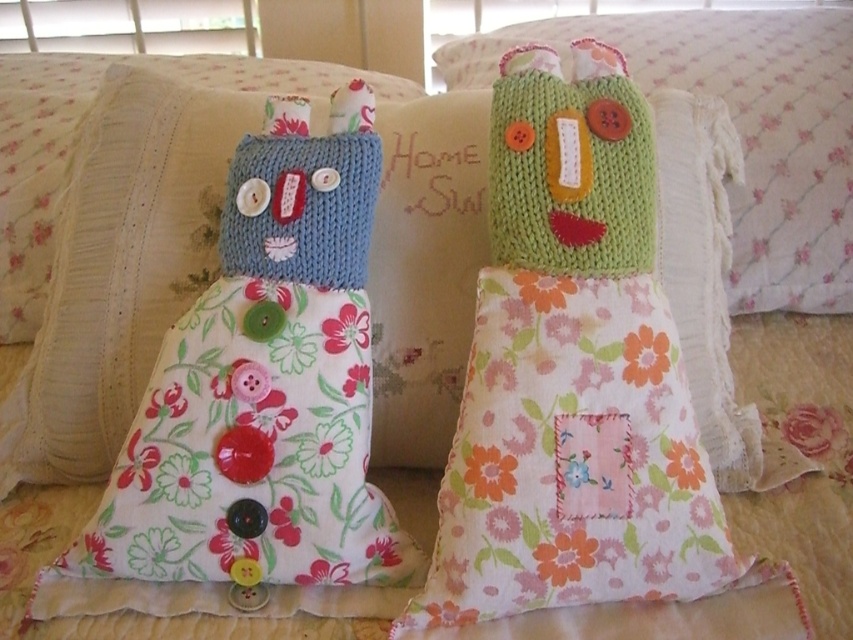
Which of these two, knitted green doll at center or green knitted pillow at center, stands taller?

Standing taller between the two is knitted green doll at center.

Can you confirm if knitted green doll at center is positioned below green knitted pillow at center?

Indeed, knitted green doll at center is positioned under green knitted pillow at center.

Is point (397, 621) less distant than point (756, 284)?

Yes, point (397, 621) is in front of point (756, 284).

This screenshot has width=853, height=640. In order to click on knitted green doll at center in this screenshot , I will do `click(572, 384)`.